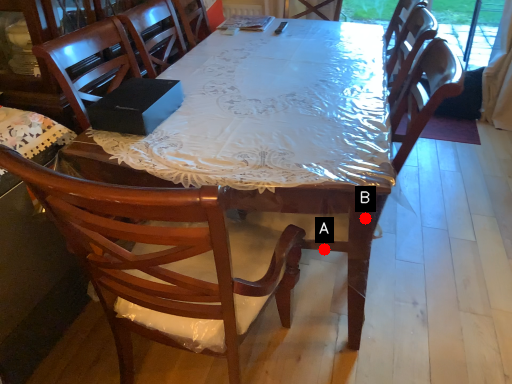
Question: Two points are circled on the image, labeled by A and B beside each circle. Which point appears farthest from the camera in this image?

Choices:
 (A) A is further
 (B) B is further

Answer: (A)